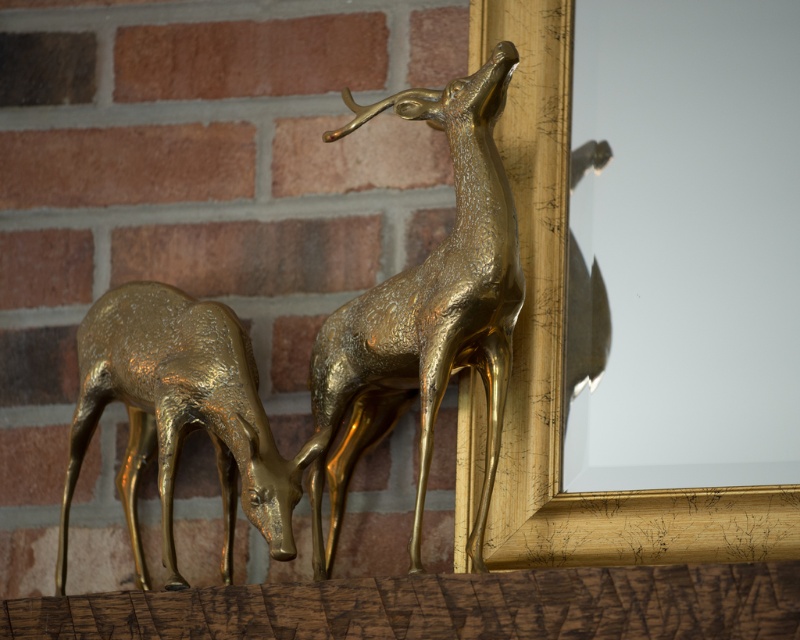
Describe the element at coordinates (425, 310) in the screenshot. I see `shiny gold deer at upper center` at that location.

Between point (452, 84) and point (272, 513), which one is positioned in front?

Positioned in front is point (272, 513).

The height and width of the screenshot is (640, 800). I want to click on shiny gold deer at upper center, so coord(425,310).